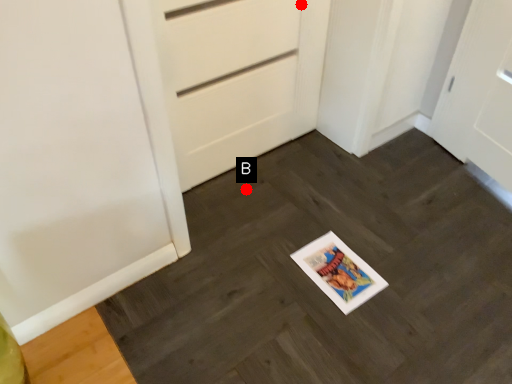
Question: Two points are circled on the image, labeled by A and B beside each circle. Which point is closer to the camera?

Choices:
 (A) A is closer
 (B) B is closer

Answer: (A)